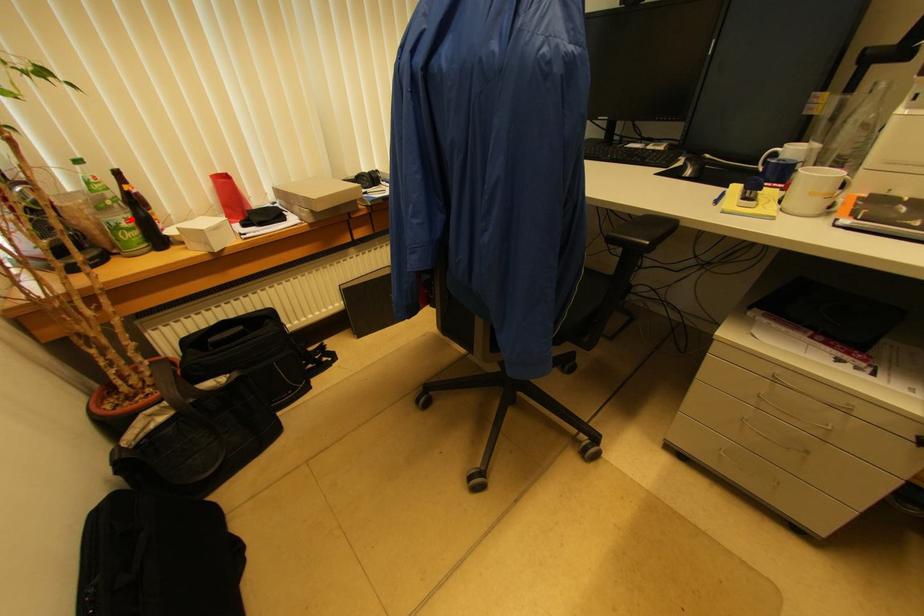
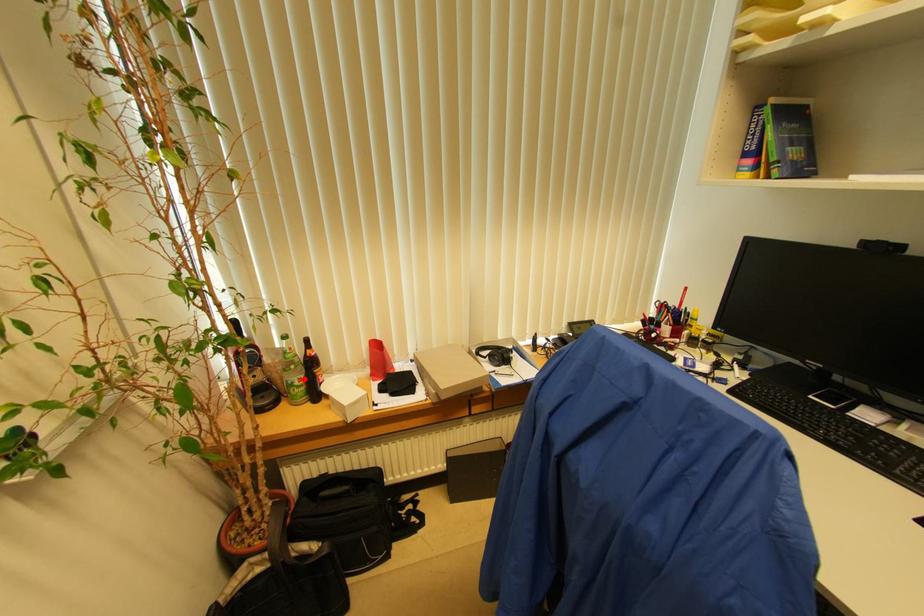
I am providing you with two images of the same scene from different viewpoints. A red point is marked on the first image and another point is marked on the second image. Are the points marked in image1 and image2 representing the same 3D position?

Yes